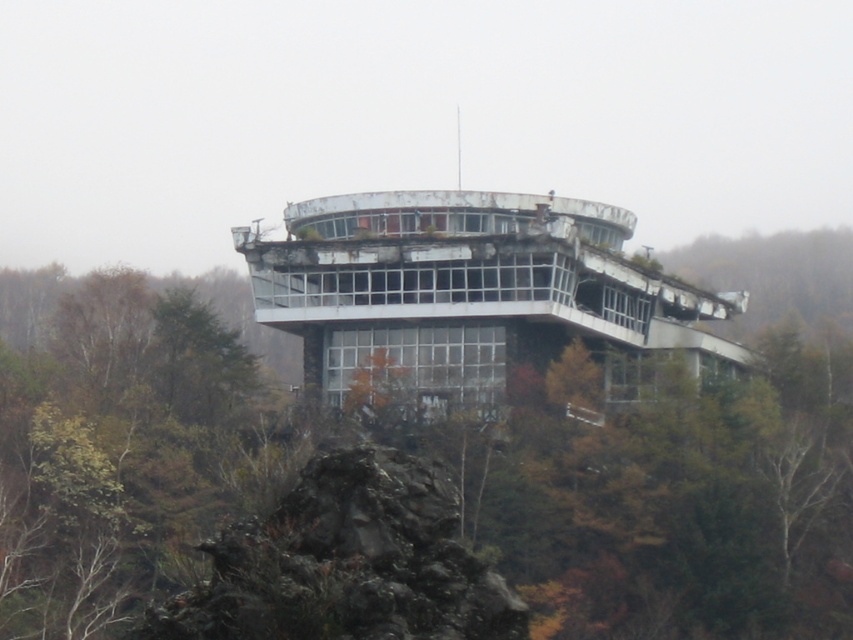
You are standing at the base of the abandoned building and looking towards the center of the image. Which object is positioned to the right of the other between the green leafy tree at center and the dark gray rough rock at center?

The green leafy tree at center is positioned to the right of the dark gray rough rock at center.

You are a hiker who wants to take a photo of the green leafy tree at center and the dark gray rough rock at center. Which object should you focus on first if you want to capture both in a single frame without moving the camera?

Since the green leafy tree at center is bigger than the dark gray rough rock at center, you should focus on the green leafy tree at center first to ensure it fills the frame appropriately while still capturing the smaller rock in the background.